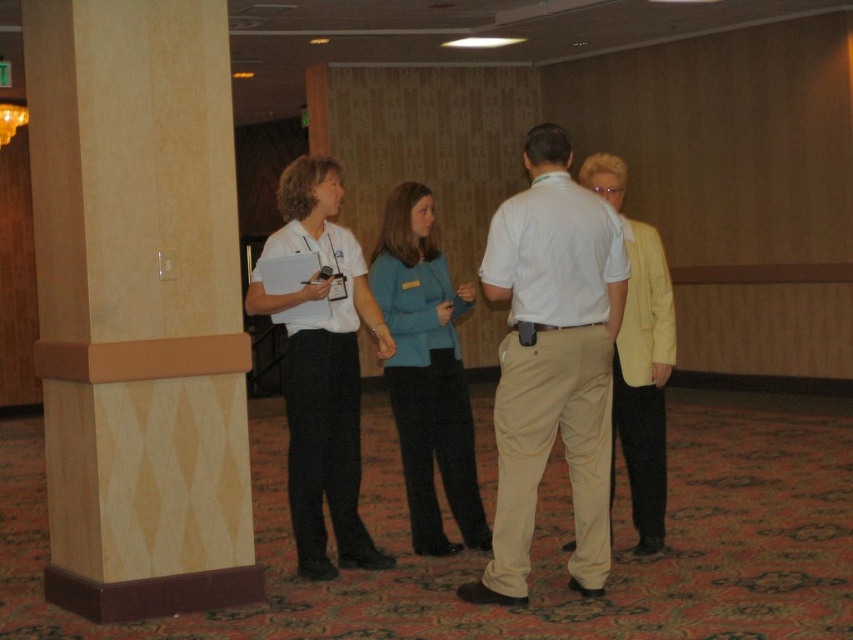
Question: Is white cotton shirt at center to the left of white matte shirt at center from the viewer's perspective?

Choices:
 (A) no
 (B) yes

Answer: (A)

Question: Can you confirm if beige textured pillar at left is smaller than light yellow fabric jacket at right?

Choices:
 (A) no
 (B) yes

Answer: (A)

Question: Estimate the real-world distances between objects in this image. Which object is closer to the light yellow fabric jacket at right?

Choices:
 (A) teal fabric jacket at center
 (B) white cotton shirt at center
 (C) beige textured pillar at left

Answer: (B)

Question: Which point is closer to the camera taking this photo?

Choices:
 (A) (645, 417)
 (B) (126, 520)
 (C) (607, 419)

Answer: (B)

Question: Is beige textured pillar at left above white matte shirt at center?

Choices:
 (A) yes
 (B) no

Answer: (A)

Question: Among these points, which one is nearest to the camera?

Choices:
 (A) (235, 348)
 (B) (527, 449)
 (C) (392, 385)
 (D) (621, 356)

Answer: (B)